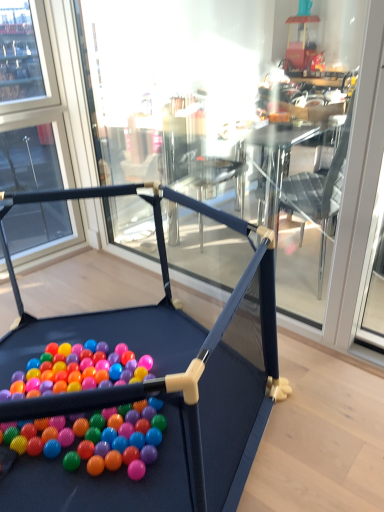
What do you see at coordinates (172, 379) in the screenshot? I see `matte black playpen at center` at bounding box center [172, 379].

Locate an element on the screen. matte black playpen at center is located at coordinates (172, 379).

The image size is (384, 512). In order to click on matte black playpen at center in this screenshot , I will do `click(172, 379)`.